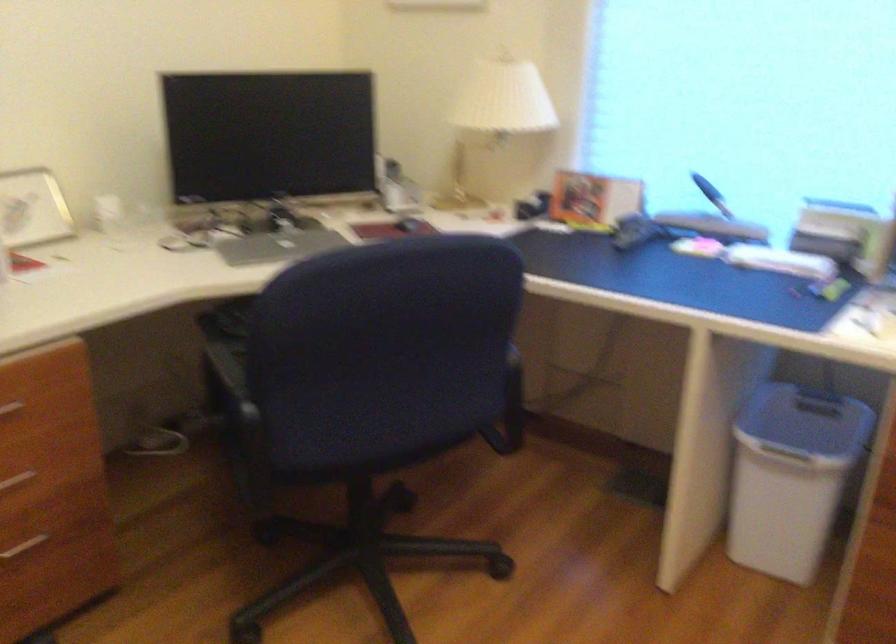
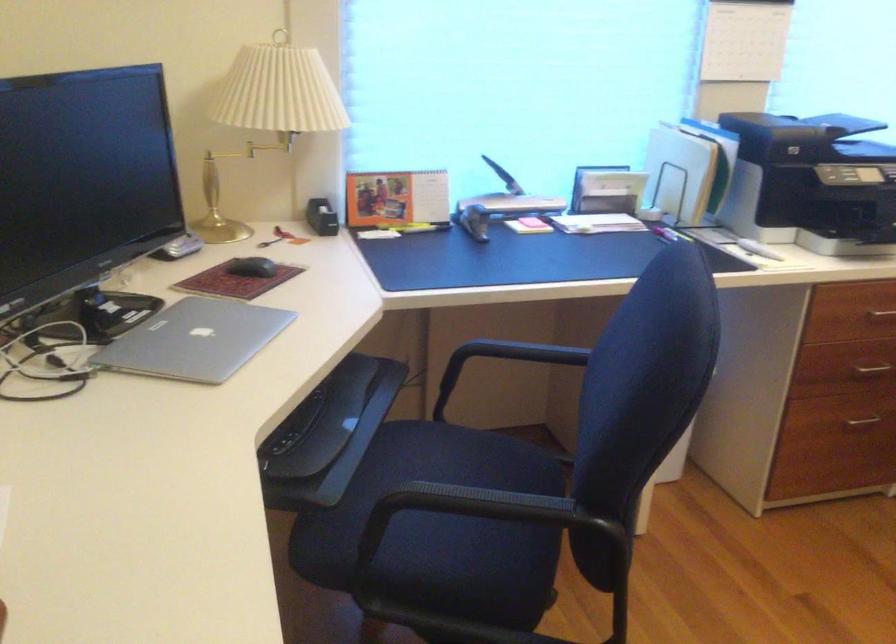
Where in the second image is the point corresponding to [694,223] from the first image?

(502, 205)